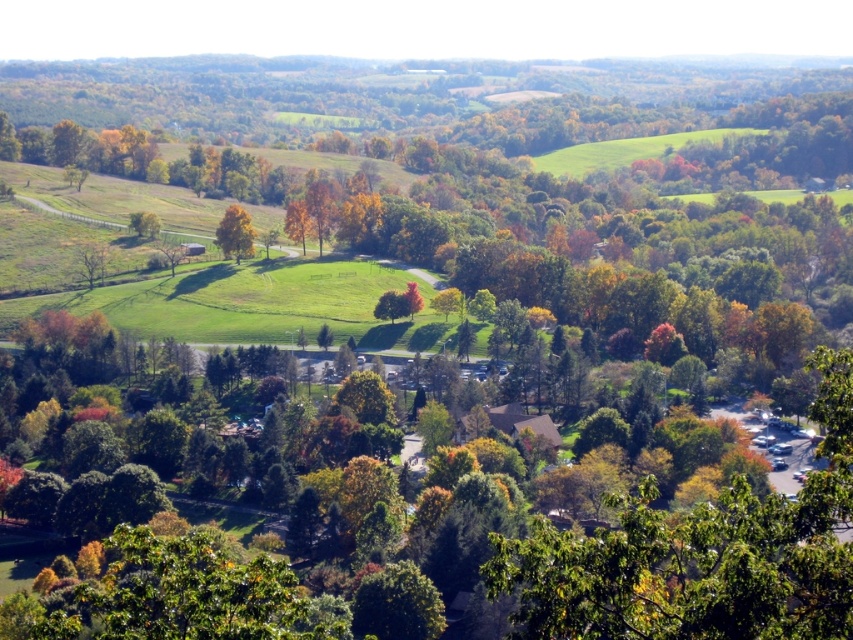
Is yellow-green leafy tree at center-left smaller than orange matte tree at center?

Actually, yellow-green leafy tree at center-left might be larger than orange matte tree at center.

You are a GUI agent. You are given a task and a screenshot of the screen. Output one action in this format:
    pyautogui.click(x=<x>, y=<y>)
    Task: Click on the yellow-green leafy tree at center-left
    The width and height of the screenshot is (853, 640).
    Given the screenshot: What is the action you would take?
    pyautogui.click(x=235, y=232)

Describe the element at coordinates (235, 232) in the screenshot. This screenshot has width=853, height=640. I see `yellow-green leafy tree at center-left` at that location.

Where is `yellow-green leafy tree at center-left`? yellow-green leafy tree at center-left is located at coordinates (235, 232).

Is yellow-green leafy tree at center-left wider than green matte tree at center?

Yes, yellow-green leafy tree at center-left is wider than green matte tree at center.

Is yellow-green leafy tree at center-left positioned in front of green matte tree at center?

No, yellow-green leafy tree at center-left is behind green matte tree at center.

Is point (247, 212) closer to camera compared to point (376, 310)?

No, (247, 212) is behind (376, 310).

I want to click on yellow-green leafy tree at center-left, so click(x=235, y=232).

Who is higher up, orange matte tree at center or green matte tree at center?

orange matte tree at center

Where is `orange matte tree at center`? This screenshot has width=853, height=640. orange matte tree at center is located at coordinates (299, 221).